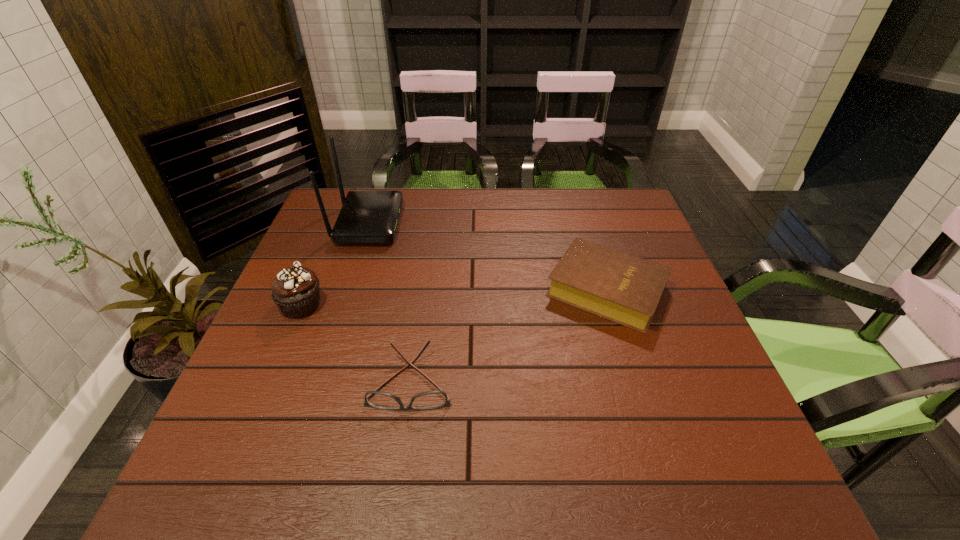
Where is `free space at the near right corner`? This screenshot has width=960, height=540. free space at the near right corner is located at coordinates (747, 474).

You are a GUI agent. You are given a task and a screenshot of the screen. Output one action in this format:
    pyautogui.click(x=<x>, y=<y>)
    Task: Click on the free spot between the second tallest object and the third tallest object
    This screenshot has width=960, height=540.
    Given the screenshot: What is the action you would take?
    pyautogui.click(x=454, y=298)

This screenshot has width=960, height=540. I want to click on free space between the nearest object and the third shortest object, so pyautogui.click(x=356, y=343).

Where is `unoccupied area between the nearest object and the cupcake`? Image resolution: width=960 pixels, height=540 pixels. unoccupied area between the nearest object and the cupcake is located at coordinates (356, 343).

At what (x,y) coordinates should I click in order to perform the action: click on vacant region between the spectacles and the router. Please return your answer as a coordinate pair (x, y). The image size is (960, 540). Looking at the image, I should click on (390, 302).

You are a GUI agent. You are given a task and a screenshot of the screen. Output one action in this format:
    pyautogui.click(x=<x>, y=<y>)
    Task: Click on the free spot between the tallest object and the spectacles
    The image size is (960, 540).
    Given the screenshot: What is the action you would take?
    pyautogui.click(x=390, y=302)

Identify the location of free spot between the router and the cupcake. The width and height of the screenshot is (960, 540). (335, 264).

Image resolution: width=960 pixels, height=540 pixels. What are the coordinates of `free point between the Bible and the shortest object` in the screenshot? It's located at (509, 335).

Find the location of a particular element. The image size is (960, 540). vacant space that's between the third object from left to right and the Bible is located at coordinates (509, 335).

In order to click on free space between the router and the cupcake in this screenshot , I will do `click(335, 264)`.